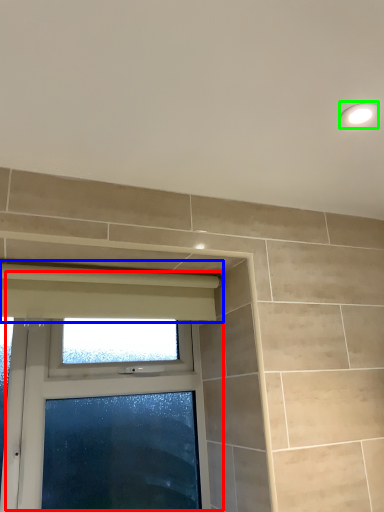
Question: Which is nearer to the window (highlighted by a red box)? curtain (highlighted by a blue box) or light fixture (highlighted by a green box).

Choices:
 (A) curtain
 (B) light fixture

Answer: (A)